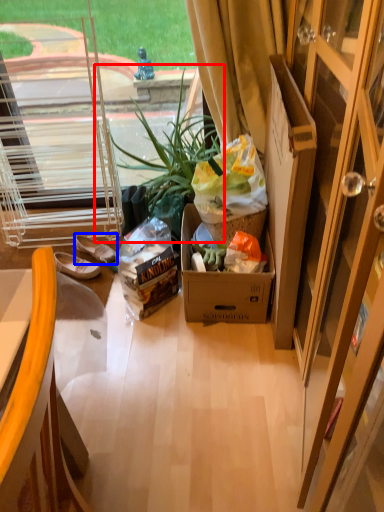
Question: Which object appears closest to the camera in this image, houseplant (highlighted by a red box) or footwear (highlighted by a blue box)?

Choices:
 (A) houseplant
 (B) footwear

Answer: (A)